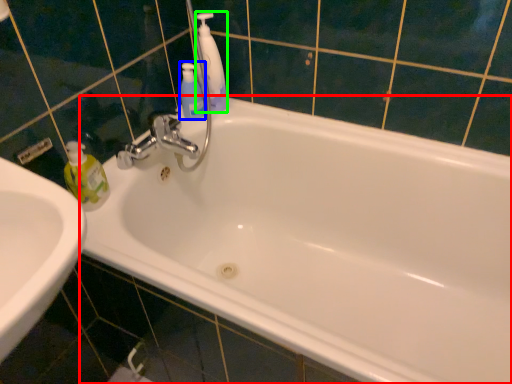
Question: Which is nearer to the bathtub (highlighted by a red box)? mouthwash (highlighted by a blue box) or cleaning product (highlighted by a green box).

Choices:
 (A) mouthwash
 (B) cleaning product

Answer: (B)